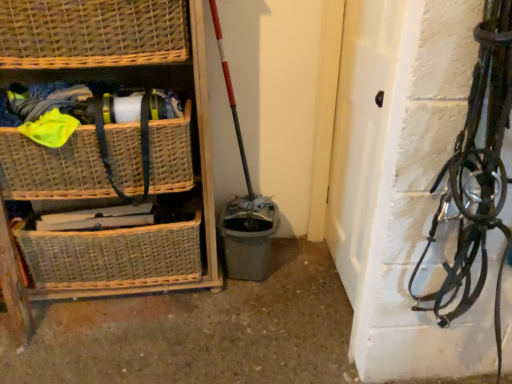
Question: Can you confirm if woven wicker basket at lower left, positioned as the 3th basket in top-to-bottom order, is thinner than woven wicker basket at left, the second basket from the bottom?

Choices:
 (A) no
 (B) yes

Answer: (B)

Question: Is woven wicker basket at lower left, positioned as the 3th basket in top-to-bottom order, not within woven wicker basket at left, the second basket from the bottom?

Choices:
 (A) yes
 (B) no

Answer: (A)

Question: Does woven wicker basket at lower left, which appears as the first basket when ordered from the bottom, lie in front of woven wicker basket at left, the second basket positioned from the top?

Choices:
 (A) no
 (B) yes

Answer: (A)

Question: Does woven wicker basket at lower left, positioned as the 3th basket in top-to-bottom order, contain woven wicker basket at left, the second basket from the bottom?

Choices:
 (A) no
 (B) yes

Answer: (A)

Question: Is woven wicker basket at left, the second basket positioned from the top, at the back of woven wicker basket at lower left, positioned as the 3th basket in top-to-bottom order?

Choices:
 (A) no
 (B) yes

Answer: (A)

Question: Visually, is woven wicker basket at upper left, placed as the 1th basket when sorted from top to bottom, positioned to the left or to the right of white matte door at center?

Choices:
 (A) right
 (B) left

Answer: (B)

Question: Looking at the image, does woven wicker basket at upper left, the 3th basket from the bottom, seem bigger or smaller compared to white matte door at center?

Choices:
 (A) small
 (B) big

Answer: (A)

Question: From a real-world perspective, is woven wicker basket at upper left, placed as the 1th basket when sorted from top to bottom, above or below white matte door at center?

Choices:
 (A) below
 (B) above

Answer: (B)

Question: In terms of width, does woven wicker basket at upper left, the 3th basket from the bottom, look wider or thinner when compared to white matte door at center?

Choices:
 (A) thin
 (B) wide

Answer: (B)

Question: From the image's perspective, is woven wicker basket at left positioned above or below woven wicker basket at upper left, the 3th basket from the bottom?

Choices:
 (A) above
 (B) below

Answer: (B)

Question: Considering the positions of woven wicker basket at left and woven wicker basket at upper left, the 3th basket from the bottom, in the image, is woven wicker basket at left bigger or smaller than woven wicker basket at upper left, the 3th basket from the bottom,?

Choices:
 (A) small
 (B) big

Answer: (B)

Question: Is woven wicker basket at left inside the boundaries of woven wicker basket at upper left, the 3th basket from the bottom, or outside?

Choices:
 (A) inside
 (B) outside

Answer: (B)

Question: Considering the positions of woven wicker basket at left and woven wicker basket at upper left, placed as the 1th basket when sorted from top to bottom, in the image, is woven wicker basket at left wider or thinner than woven wicker basket at upper left, placed as the 1th basket when sorted from top to bottom,?

Choices:
 (A) wide
 (B) thin

Answer: (A)

Question: In terms of height, does woven wicker basket at lower left, which appears as the first basket when ordered from the bottom, look taller or shorter compared to woven wicker basket at left, the second basket positioned from the top?

Choices:
 (A) short
 (B) tall

Answer: (B)

Question: In the image, is woven wicker basket at lower left, which appears as the first basket when ordered from the bottom, on the left side or the right side of woven wicker basket at left, the second basket positioned from the top?

Choices:
 (A) left
 (B) right

Answer: (A)